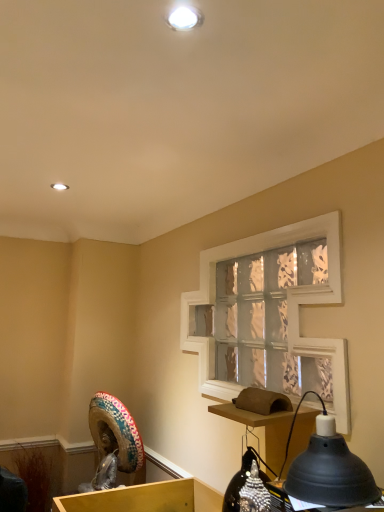
Question: Is clear glass window screen at center facing towards black matte lamp at lower right?

Choices:
 (A) no
 (B) yes

Answer: (A)

Question: Is black matte lamp at lower right at the back of clear glass window screen at center?

Choices:
 (A) yes
 (B) no

Answer: (B)

Question: Considering the relative sizes of clear glass window screen at center and black matte lamp at lower right in the image provided, is clear glass window screen at center thinner than black matte lamp at lower right?

Choices:
 (A) no
 (B) yes

Answer: (B)

Question: Is the depth of clear glass window screen at center less than that of black matte lamp at lower right?

Choices:
 (A) no
 (B) yes

Answer: (A)

Question: Is clear glass window screen at center with black matte lamp at lower right?

Choices:
 (A) yes
 (B) no

Answer: (B)

Question: Is clear glass window screen at center at the right side of black matte lamp at lower right?

Choices:
 (A) no
 (B) yes

Answer: (A)

Question: Is black matte lamp at lower right outside of clear glass window screen at center?

Choices:
 (A) no
 (B) yes

Answer: (B)

Question: Is black matte lamp at lower right wider than clear glass window screen at center?

Choices:
 (A) no
 (B) yes

Answer: (B)

Question: From a real-world perspective, is black matte lamp at lower right beneath clear glass window screen at center?

Choices:
 (A) yes
 (B) no

Answer: (A)

Question: Is black matte lamp at lower right further to camera compared to clear glass window screen at center?

Choices:
 (A) no
 (B) yes

Answer: (A)

Question: Is black matte lamp at lower right far away from clear glass window screen at center?

Choices:
 (A) no
 (B) yes

Answer: (A)

Question: Can you confirm if black matte lamp at lower right is thinner than clear glass window screen at center?

Choices:
 (A) no
 (B) yes

Answer: (A)

Question: From a real-world perspective, is matte white recessed light at upper center physically above brown cardboard table at lower right?

Choices:
 (A) yes
 (B) no

Answer: (A)